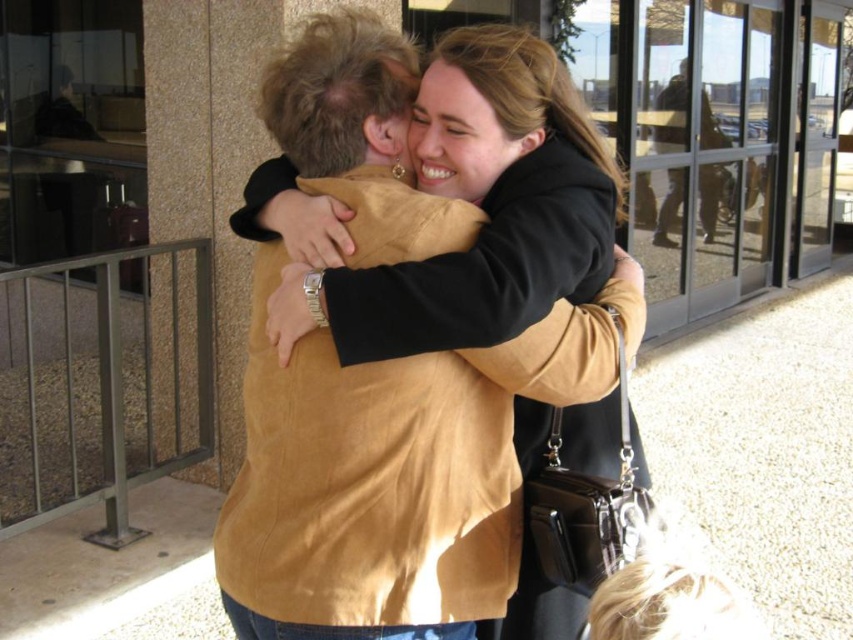
You are a photographer standing at the entrance of the building. You want to take a photo of both the matte brown jacket at center and the brown suede jacket at upper right. Which jacket should you focus on first to ensure both are in frame?

You should focus on the matte brown jacket at center first since it is closer to the viewer, ensuring both jackets are in frame by adjusting the camera angle to include the brown suede jacket at upper right which is further away.

You are a photographer trying to capture a candid shot of the two people in the scene. You want to ensure that both the matte brown jacket at center and the brown suede jacket at upper right are clearly visible in your photo. Based on their positions, which jacket should you focus on first to frame them properly?

The matte brown jacket at center is positioned on the left side of the brown suede jacket at upper right, so you should focus on the matte brown jacket at center first to ensure both are framed properly.

You are an airport security guard checking the height requirements for a new luggage rack. The minimum height requirement for the rack is 1.2 meters. You observe the matte brown jacket at center and the brown suede jacket at upper right in the image. Which jacket meets the height requirement?

The brown suede jacket at upper right meets the height requirement as it is taller than the matte brown jacket at center, which is below the 1.2 meters minimum.